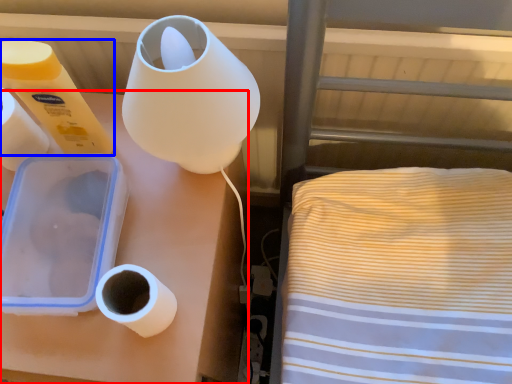
Question: Which of the following is the farthest to the observer, furniture (highlighted by a red box) or toilet paper (highlighted by a blue box)?

Choices:
 (A) furniture
 (B) toilet paper

Answer: (A)